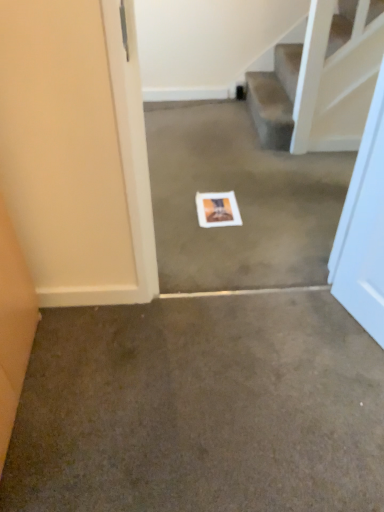
Find the location of a particular element. empty space that is ontop of brown carpet at center, arranged as the 2th concrete when viewed from the back (from a real-world perspective) is located at coordinates (203, 382).